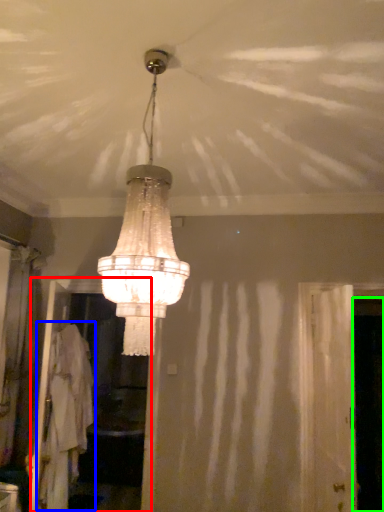
Question: Considering the real-world distances, which object is closest to screen door (highlighted by a red box)? robe (highlighted by a blue box) or screen door (highlighted by a green box).

Choices:
 (A) robe
 (B) screen door

Answer: (A)